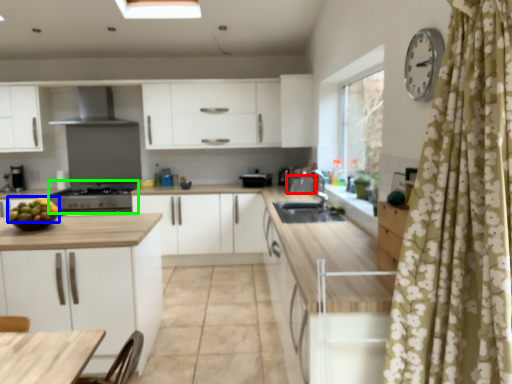
Question: Which object is positioned farthest from appliance (highlighted by a red box)? Select from fruit (highlighted by a blue box) and appliance (highlighted by a green box).

Choices:
 (A) fruit
 (B) appliance

Answer: (A)